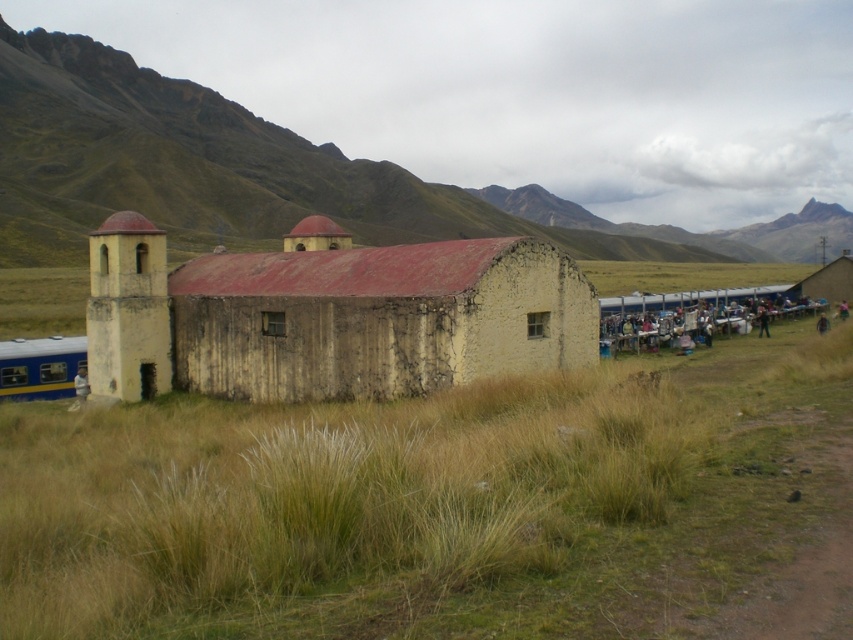
Question: Which of the following is the closest to the observer?

Choices:
 (A) dry grass at center
 (B) blue painted metal train at left
 (C) rugged stone mountain at upper left
 (D) white plastic chairs at right

Answer: (A)

Question: Which of the following is the farthest from the observer?

Choices:
 (A) (64, 342)
 (B) (515, 320)
 (C) (543, 216)

Answer: (C)

Question: Is rugged stone mountain at upper left wider than yellow concrete building at center?

Choices:
 (A) yes
 (B) no

Answer: (A)

Question: Estimate the real-world distances between objects in this image. Which object is closer to the white plastic chairs at right?

Choices:
 (A) blue painted metal train at left
 (B) rugged stone mountain at upper left
 (C) dry grass at center
 (D) yellow concrete building at center

Answer: (D)

Question: From the image, what is the correct spatial relationship of dry grass at center in relation to white plastic chairs at right?

Choices:
 (A) below
 (B) above

Answer: (A)

Question: From the image, what is the correct spatial relationship of dry grass at center in relation to yellow concrete building at center?

Choices:
 (A) left
 (B) right

Answer: (B)